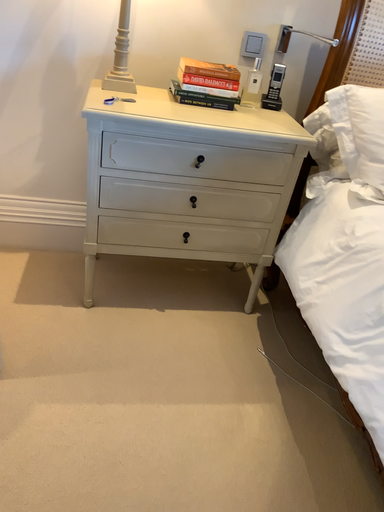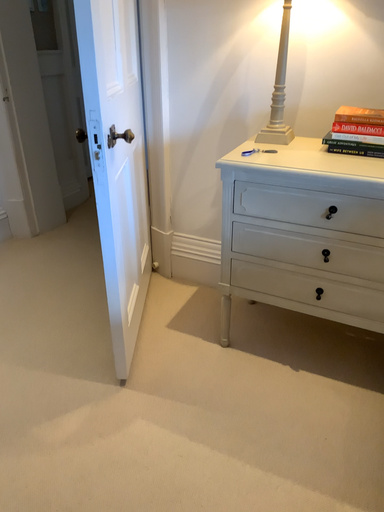
Question: Which way did the camera rotate in the video?

Choices:
 (A) rotated right
 (B) rotated left

Answer: (B)